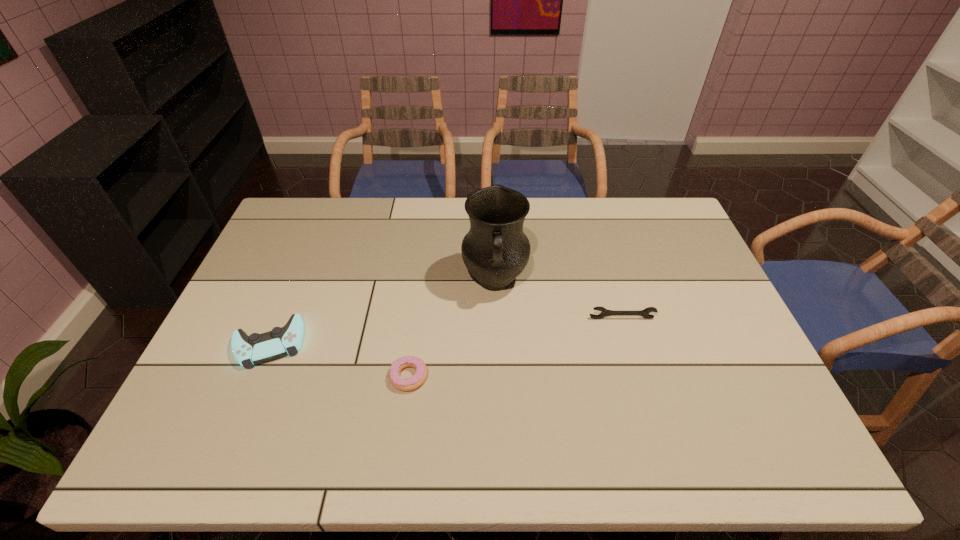
The image size is (960, 540). What are the coordinates of `vacant region located 0.300m on the left of the shortest object` in the screenshot? It's located at point(273,376).

Where is `object that is at the left edge`? The image size is (960, 540). object that is at the left edge is located at coordinates (257, 348).

In the image, there is a desktop. What are the coordinates of `free region at the far edge` in the screenshot? It's located at (594, 220).

Find the location of a particular element. Image resolution: width=960 pixels, height=540 pixels. vacant region at the near edge is located at coordinates point(652,436).

Image resolution: width=960 pixels, height=540 pixels. In the image, there is a desktop. What are the coordinates of `free space at the left edge` in the screenshot? It's located at (286, 267).

Locate an element on the screen. The image size is (960, 540). blank space at the right edge of the desktop is located at coordinates (718, 322).

Find the location of a particular element. The image size is (960, 540). vacant space at the far left corner of the desktop is located at coordinates (302, 222).

At what (x,y) coordinates should I click in order to perform the action: click on vacant space at the far right corner. Please return your answer as a coordinate pair (x, y). This screenshot has height=540, width=960. Looking at the image, I should click on (646, 215).

Identify the location of blank region between the control and the farthest object. The width and height of the screenshot is (960, 540). (382, 312).

Locate an element on the screen. free spot between the rightmost object and the leftmost object is located at coordinates point(445,331).